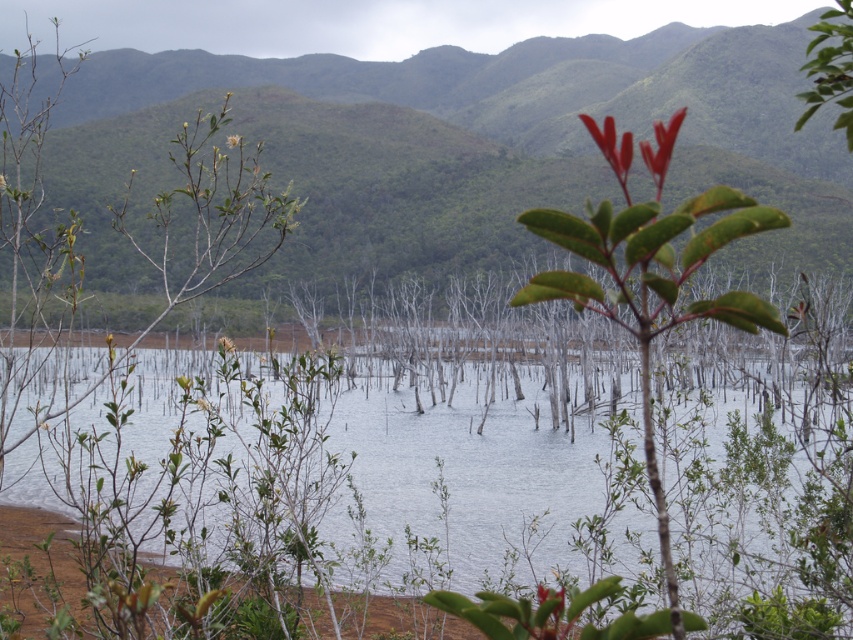
Between point (662, 141) and point (561, 589), which one is positioned behind?

Positioned behind is point (561, 589).

Does glossy red leaves at upper center appear on the right side of smooth glossy red flower at center?

Indeed, glossy red leaves at upper center is positioned on the right side of smooth glossy red flower at center.

Who is more distant from viewer, (668, 150) or (560, 589)?

The point (560, 589) is more distant.

This screenshot has height=640, width=853. In order to click on glossy red leaves at upper center in this screenshot , I will do `click(611, 145)`.

Can you confirm if yellow textured flower at center is wider than green matte flower at upper left?

In fact, yellow textured flower at center might be narrower than green matte flower at upper left.

Who is more distant from viewer, (204, 397) or (0, 176)?

Point (204, 397)

The image size is (853, 640). I want to click on yellow textured flower at center, so click(202, 404).

Which is more to the left, green glossy leaf at upper right or shiny red leaf at upper right?

shiny red leaf at upper right is more to the left.

Who is more distant from viewer, (834, 93) or (627, 157)?

Point (834, 93)

Locate an element on the screen. Image resolution: width=853 pixels, height=640 pixels. green glossy leaf at upper right is located at coordinates (830, 68).